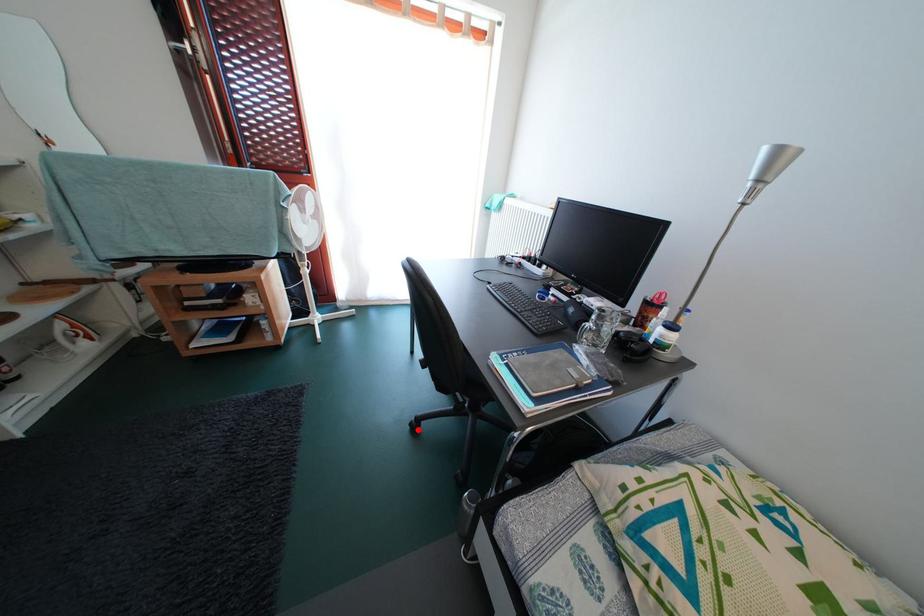
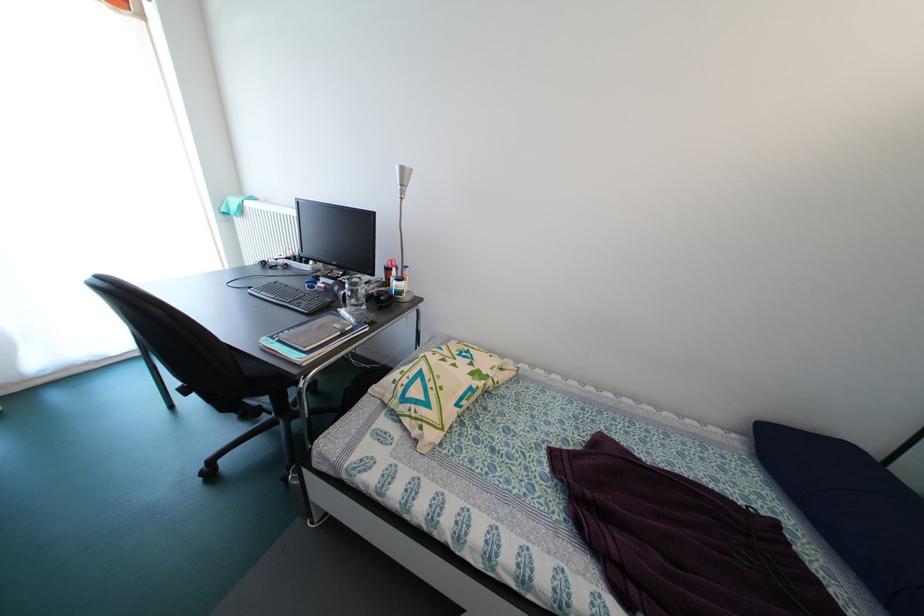
The point at the highlighted location is marked in the first image. Where is the corresponding point in the second image?

(209, 479)